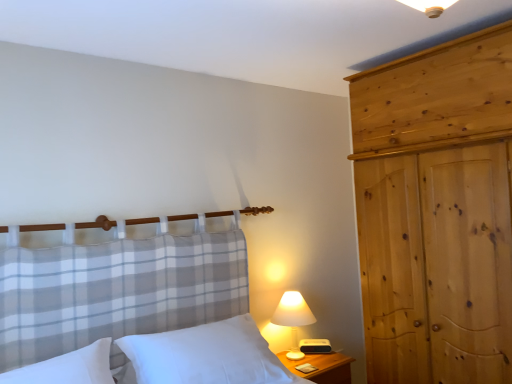
Question: Can you confirm if white soft pillow at lower left is positioned to the right of white fabric lampshade at right?

Choices:
 (A) no
 (B) yes

Answer: (A)

Question: From the image's perspective, is white soft pillow at lower left below white fabric lampshade at right?

Choices:
 (A) no
 (B) yes

Answer: (A)

Question: Considering the relative sizes of white soft pillow at lower left and white fabric lampshade at right in the image provided, is white soft pillow at lower left thinner than white fabric lampshade at right?

Choices:
 (A) no
 (B) yes

Answer: (A)

Question: Is white soft pillow at lower left at the left side of white fabric lampshade at right?

Choices:
 (A) no
 (B) yes

Answer: (B)

Question: Does white soft pillow at lower left come behind white fabric lampshade at right?

Choices:
 (A) yes
 (B) no

Answer: (B)

Question: From the image's perspective, is white soft pillow at lower left positioned above or below white fabric lampshade at right?

Choices:
 (A) below
 (B) above

Answer: (B)

Question: Is white soft pillow at lower left situated inside white fabric lampshade at right or outside?

Choices:
 (A) inside
 (B) outside

Answer: (B)

Question: In terms of height, does white soft pillow at lower left look taller or shorter compared to white fabric lampshade at right?

Choices:
 (A) tall
 (B) short

Answer: (B)

Question: In the image, is white soft pillow at lower left on the left side or the right side of white fabric lampshade at right?

Choices:
 (A) left
 (B) right

Answer: (A)

Question: In the image, is white soft pillow at center positioned in front of or behind white fabric lampshade at right?

Choices:
 (A) behind
 (B) front

Answer: (B)

Question: Looking at the image, does white soft pillow at center seem bigger or smaller compared to white fabric lampshade at right?

Choices:
 (A) big
 (B) small

Answer: (A)

Question: From their relative heights in the image, would you say white soft pillow at center is taller or shorter than white fabric lampshade at right?

Choices:
 (A) tall
 (B) short

Answer: (B)

Question: From a real-world perspective, is white soft pillow at center physically located above or below white fabric lampshade at right?

Choices:
 (A) below
 (B) above

Answer: (B)

Question: In terms of width, does white soft pillow at lower left look wider or thinner when compared to wooden at right?

Choices:
 (A) thin
 (B) wide

Answer: (A)

Question: In the image, is white soft pillow at lower left on the left side or the right side of wooden at right?

Choices:
 (A) right
 (B) left

Answer: (B)